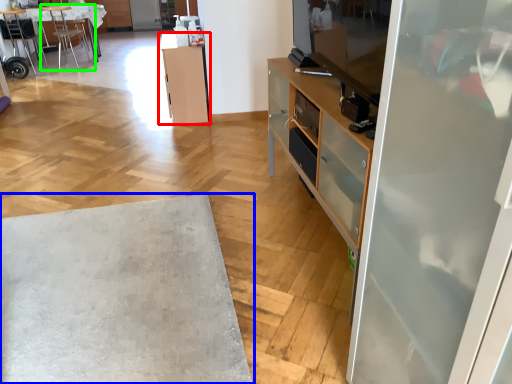
Question: Which object is positioned closest to cabinetry (highlighted by a red box)? Select from table (highlighted by a blue box) and chair (highlighted by a green box).

Choices:
 (A) table
 (B) chair

Answer: (A)